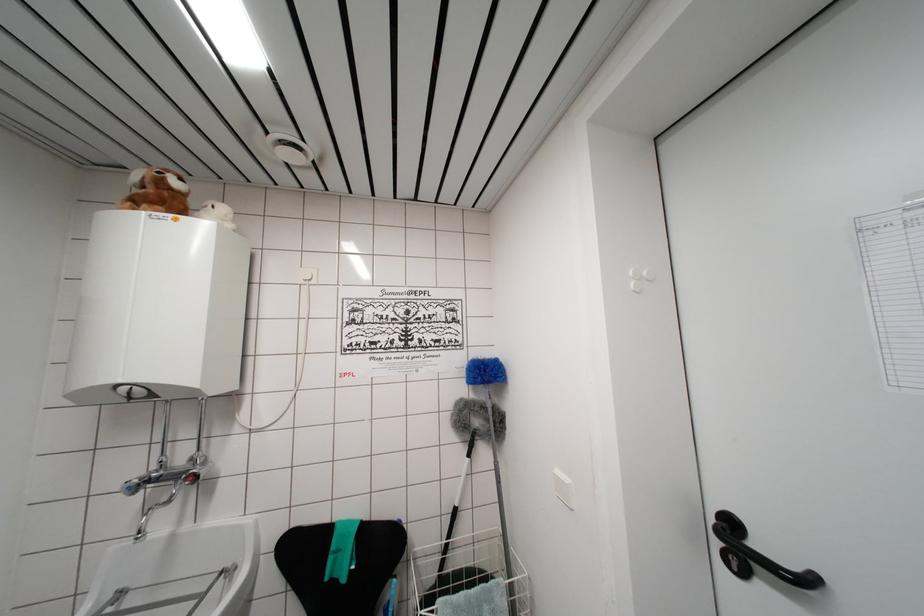
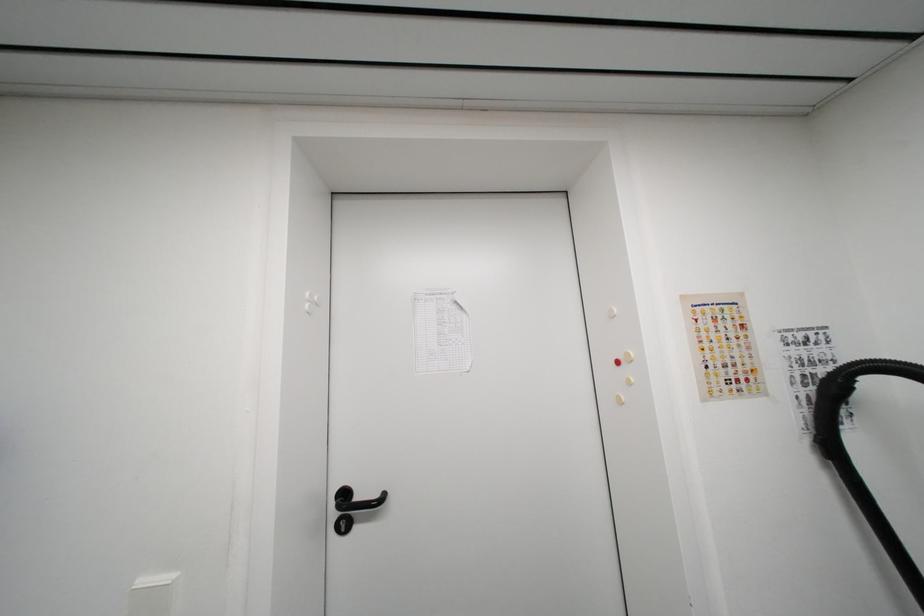
Question: The camera is either moving clockwise (left) or counter-clockwise (right) around the object. The first image is from the beginning of the video and the second image is from the end. Is the camera moving left or right when shooting the video?

Choices:
 (A) Left
 (B) Right

Answer: (A)